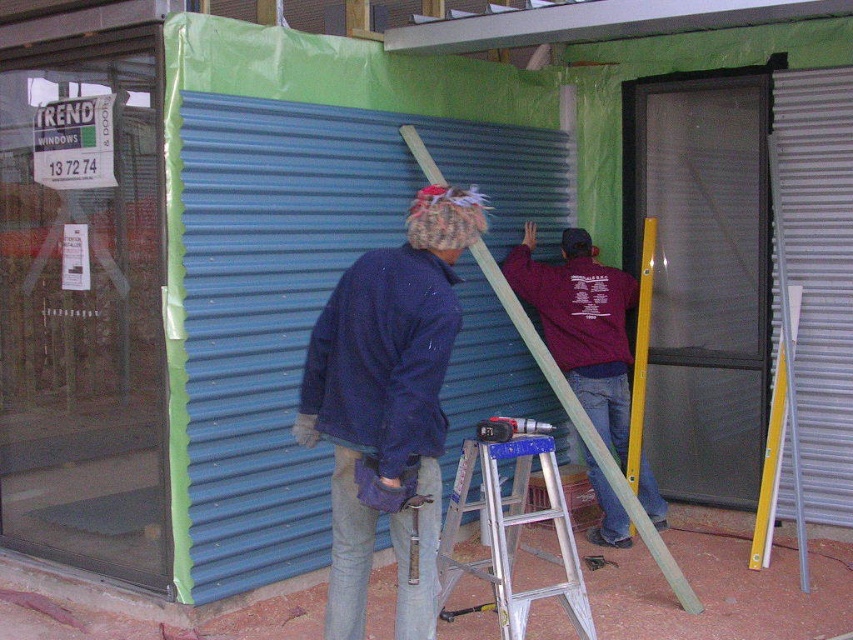
Is point (315, 384) farther from viewer compared to point (514, 432)?

No, (315, 384) is in front of (514, 432).

What do you see at coordinates (383, 356) in the screenshot? Image resolution: width=853 pixels, height=640 pixels. I see `dark blue fleece at center` at bounding box center [383, 356].

Between point (357, 364) and point (506, 424), which one is positioned in front?

Point (357, 364) is more forward.

The height and width of the screenshot is (640, 853). What are the coordinates of `dark blue fleece at center` in the screenshot? It's located at (383, 356).

Is maroon fabric shirt at upper right taller than metallic hammer at center?

Yes.

Does maroon fabric shirt at upper right have a larger size compared to metallic hammer at center?

Indeed, maroon fabric shirt at upper right has a larger size compared to metallic hammer at center.

The image size is (853, 640). In order to click on maroon fabric shirt at upper right in this screenshot , I will do `click(581, 324)`.

Is metallic silver shutter at right below metallic blue drill at center?

Actually, metallic silver shutter at right is above metallic blue drill at center.

Is point (804, 129) farther from camera compared to point (480, 436)?

Yes.

Who is more forward, (785, 93) or (480, 432)?

Point (480, 432)

At what (x,y) coordinates should I click in order to perform the action: click on metallic silver shutter at right. Please return your answer as a coordinate pair (x, y). This screenshot has height=640, width=853. Looking at the image, I should click on (819, 275).